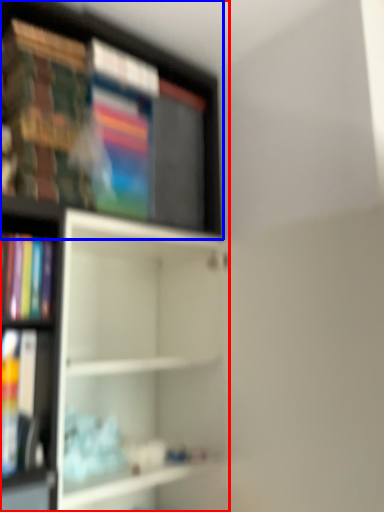
Question: Among these objects, which one is farthest to the camera, shelf (highlighted by a red box) or shelf (highlighted by a blue box)?

Choices:
 (A) shelf
 (B) shelf

Answer: (B)